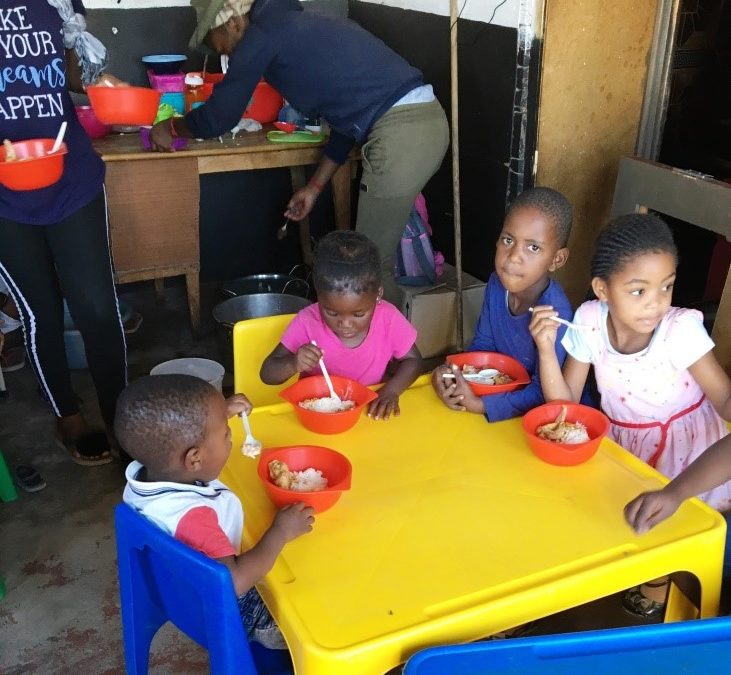
You are a GUI agent. You are given a task and a screenshot of the screen. Output one action in this format:
    pyautogui.click(x=<x>, y=<y>)
    Task: Click on the yellow table
    The height and width of the screenshot is (675, 731).
    Given the screenshot: What is the action you would take?
    pyautogui.click(x=531, y=559)